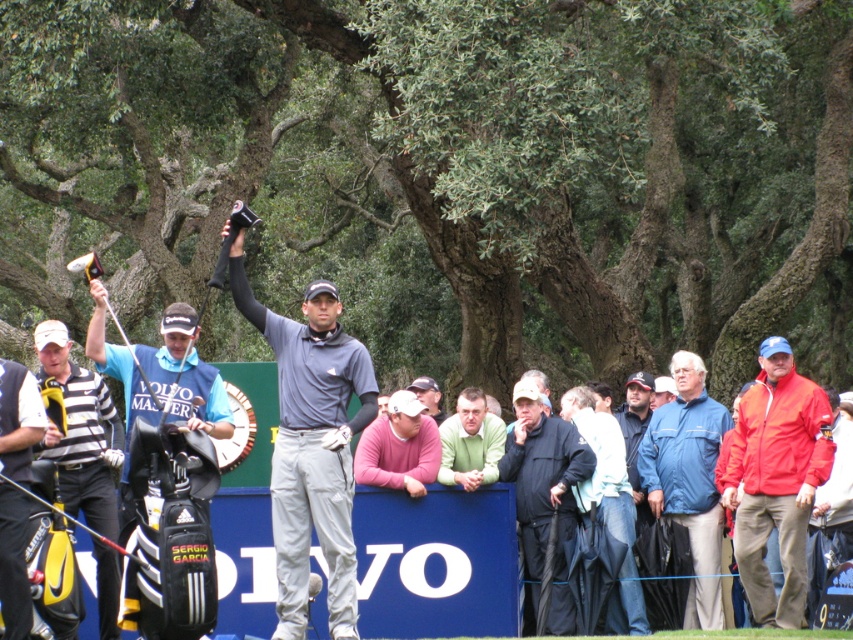
Who is shorter, blue fabric jacket at right or black matte jacket at center?

black matte jacket at center is shorter.

Is blue fabric jacket at right below black matte jacket at center?

Correct, blue fabric jacket at right is located below black matte jacket at center.

Between point (695, 424) and point (540, 419), which one is positioned behind?

The point (695, 424) is more distant.

Where is `blue fabric jacket at right`? blue fabric jacket at right is located at coordinates (689, 481).

Is pink sweater at center positioned in front of green sweater at center?

No, pink sweater at center is behind green sweater at center.

Which is behind, point (398, 412) or point (502, 436)?

The point (502, 436) is more distant.

This screenshot has height=640, width=853. Describe the element at coordinates (399, 448) in the screenshot. I see `pink sweater at center` at that location.

You are a GUI agent. You are given a task and a screenshot of the screen. Output one action in this format:
    pyautogui.click(x=<x>, y=<y>)
    Task: Click on the pink sweater at center
    
    Given the screenshot: What is the action you would take?
    pyautogui.click(x=399, y=448)

Between striped cotton polo shirt at left and green sweater at center, which one appears on the right side from the viewer's perspective?

green sweater at center is more to the right.

Looking at this image, who is shorter, striped cotton polo shirt at left or green sweater at center?

With less height is green sweater at center.

Locate an element on the screen. Image resolution: width=853 pixels, height=640 pixels. striped cotton polo shirt at left is located at coordinates (80, 433).

Where is `striped cotton polo shirt at left`? Image resolution: width=853 pixels, height=640 pixels. striped cotton polo shirt at left is located at coordinates (80, 433).